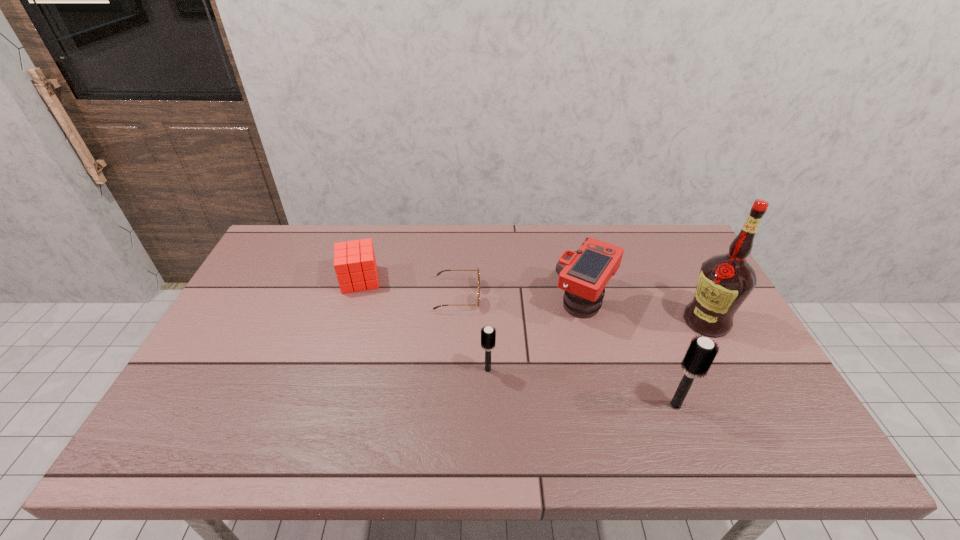
You are a GUI agent. You are given a task and a screenshot of the screen. Output one action in this format:
    pyautogui.click(x=<x>, y=<y>)
    Task: Click on the free space located 0.060m on the left of the left hairbrush
    This screenshot has width=960, height=540.
    Given the screenshot: What is the action you would take?
    pyautogui.click(x=457, y=369)

I want to click on free location located on the left of the second tallest object, so click(529, 405).

Image resolution: width=960 pixels, height=540 pixels. What are the coordinates of `free point located 0.310m on the lenses of the shortest object` in the screenshot? It's located at (584, 295).

At what (x,y) coordinates should I click in order to perform the action: click on free spot located on the front of the camera. Please return your answer as a coordinate pair (x, y). The height and width of the screenshot is (540, 960). Looking at the image, I should click on (605, 381).

At what (x,y) coordinates should I click in order to perform the action: click on vacant area located 0.250m on the label of the tallest object. Please return your answer as a coordinate pair (x, y). The image size is (960, 540). Looking at the image, I should click on (595, 321).

At what (x,y) coordinates should I click in order to perform the action: click on free spot located on the label of the tallest object. Please return your answer as a coordinate pair (x, y). The width and height of the screenshot is (960, 540). Looking at the image, I should click on (645, 321).

Locate an element on the screen. This screenshot has width=960, height=540. vacant space situated on the label of the tallest object is located at coordinates (637, 321).

Locate an element on the screen. The image size is (960, 540). vacant space situated 0.160m on the back of the leftmost object is located at coordinates (373, 237).

Locate an element on the screen. The width and height of the screenshot is (960, 540). object situated at the far edge is located at coordinates (355, 265).

At what (x,y) coordinates should I click in order to perform the action: click on object present at the near edge. Please return your answer as a coordinate pair (x, y). This screenshot has height=540, width=960. Looking at the image, I should click on (701, 352).